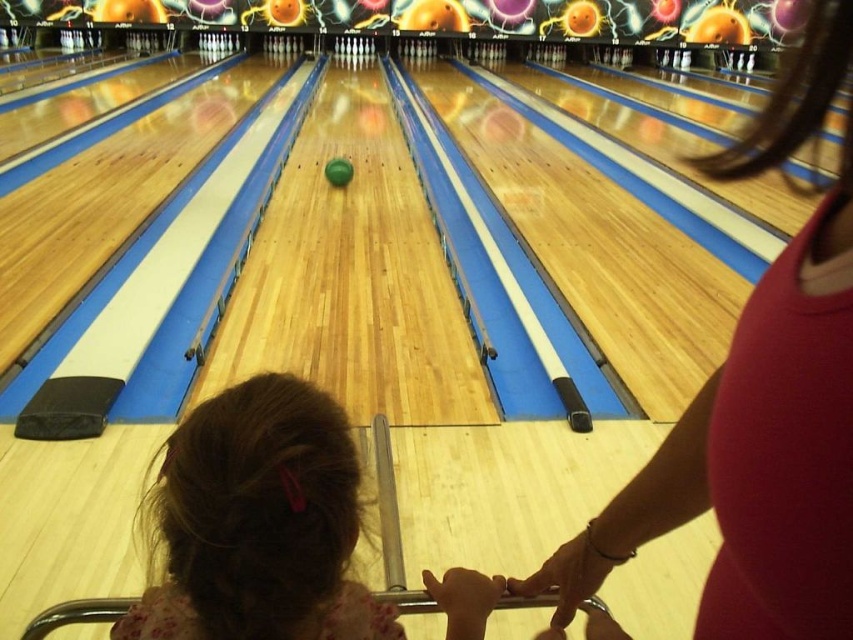
You are a photographer trying to capture the child in the center of the frame. The camera is set to focus on the point at coordinates (258, 522). Based on the scene description, what part of the child will the camera focus on?

The point at coordinates (258, 522) indicates the brown hair at center, so the camera will focus on the brown hair at center.

You are a photographer standing in the bowling alley and want to take a picture of the brown hair at center. Where should you position yourself to capture the subject in the center of the photo?

To capture the brown hair at center in the center of the photo, position yourself directly in front of the brown hair at center since its 2D location is at point (x=258, y=522).